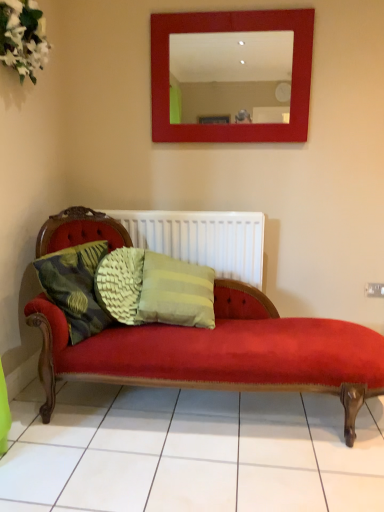
Question: Visually, is white textured radiator at center positioned to the left or to the right of white fabric flowers at upper left?

Choices:
 (A) left
 (B) right

Answer: (B)

Question: Do you think white textured radiator at center is within white fabric flowers at upper left, or outside of it?

Choices:
 (A) outside
 (B) inside

Answer: (A)

Question: Which object is the farthest from the white textured radiator at center?

Choices:
 (A) white fabric flowers at upper left
 (B) green textured cushion at left

Answer: (A)

Question: Which of these objects is positioned farthest from the green textured cushion at left?

Choices:
 (A) white fabric flowers at upper left
 (B) white textured radiator at center

Answer: (A)